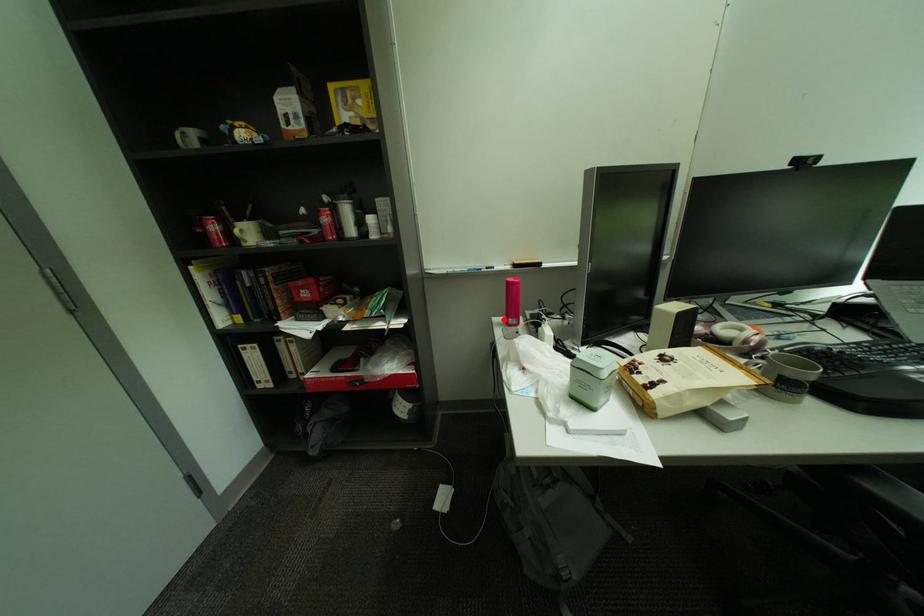
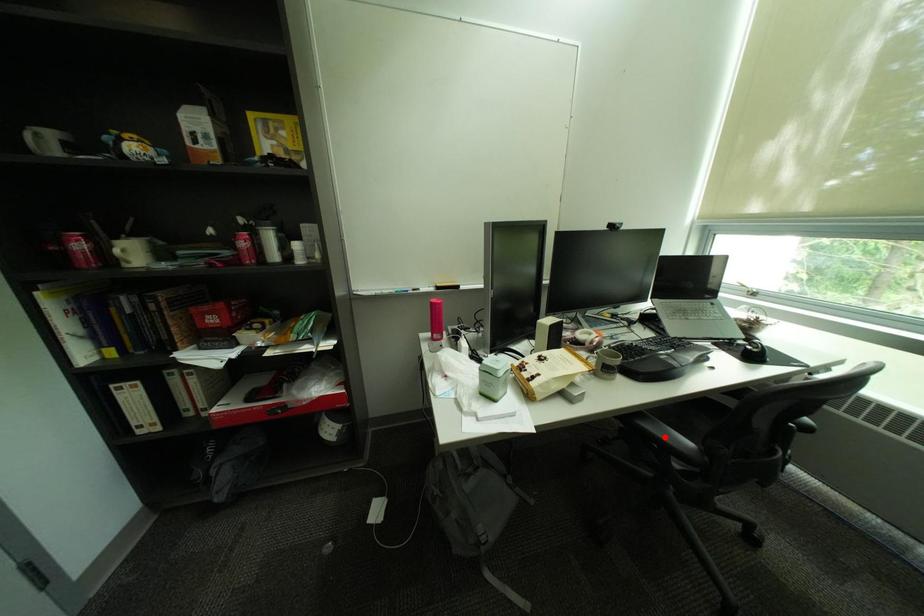
I am providing you with two images of the same scene from different viewpoints. A red point is marked on the first image and another point is marked on the second image. Does the point marked in image1 correspond to the same location as the one in image2?

No